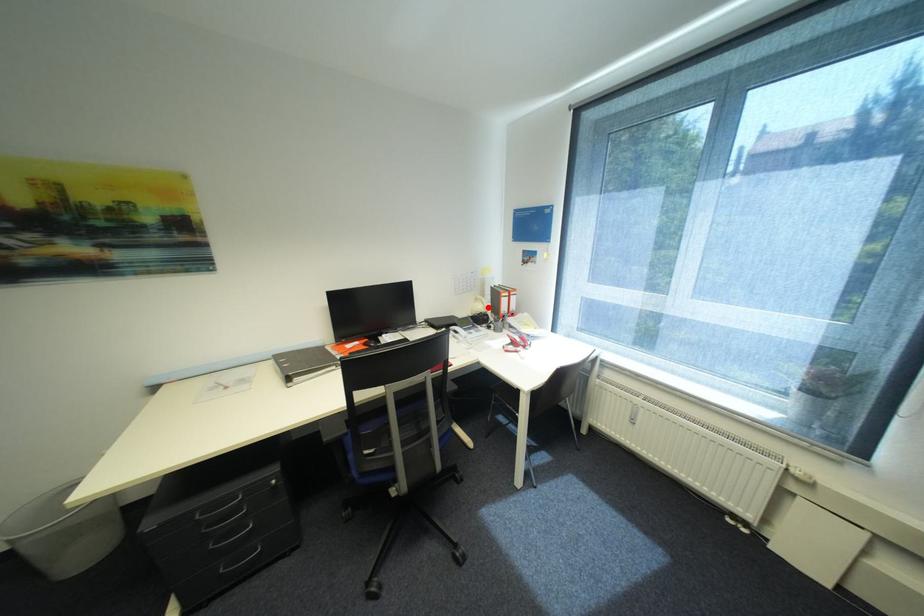
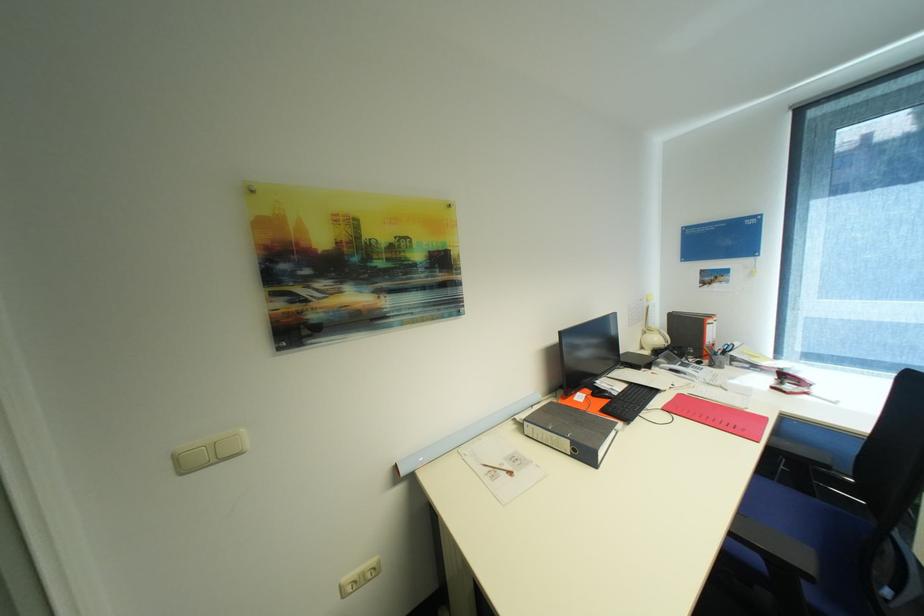
Question: I am providing you with two images of the same scene from different viewpoints. A red point is marked on the first image. At the location where the point appears in image 1, is it still visible in image 2?

Choices:
 (A) Yes
 (B) No

Answer: (A)